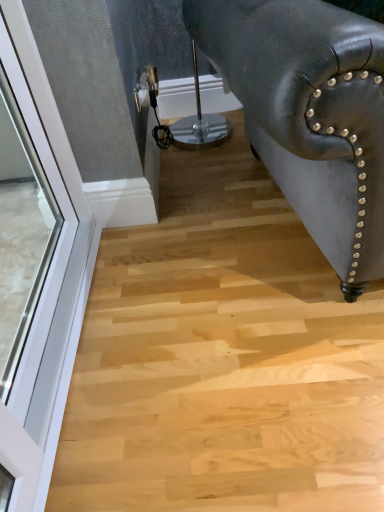
Question: Is matte black leather armchair at right surrounded by white glass window at left?

Choices:
 (A) yes
 (B) no

Answer: (B)

Question: From a real-world perspective, is white glass window at left over matte black leather armchair at right?

Choices:
 (A) no
 (B) yes

Answer: (A)

Question: Can you confirm if white glass window at left is shorter than matte black leather armchair at right?

Choices:
 (A) yes
 (B) no

Answer: (A)

Question: From the image's perspective, is white glass window at left on matte black leather armchair at right?

Choices:
 (A) no
 (B) yes

Answer: (A)

Question: Is white glass window at left positioned far away from matte black leather armchair at right?

Choices:
 (A) yes
 (B) no

Answer: (B)

Question: Is white glass window at left bigger than matte black leather armchair at right?

Choices:
 (A) yes
 (B) no

Answer: (B)

Question: Can you confirm if matte black leather armchair at right is positioned to the left of white glass window at left?

Choices:
 (A) yes
 (B) no

Answer: (B)

Question: From the image's perspective, is matte black leather armchair at right beneath white glass window at left?

Choices:
 (A) no
 (B) yes

Answer: (A)

Question: From a real-world perspective, is matte black leather armchair at right on top of white glass window at left?

Choices:
 (A) no
 (B) yes

Answer: (B)

Question: Is matte black leather armchair at right smaller than white glass window at left?

Choices:
 (A) no
 (B) yes

Answer: (A)

Question: Is matte black leather armchair at right touching white glass window at left?

Choices:
 (A) yes
 (B) no

Answer: (B)

Question: Does matte black leather armchair at right have a greater width compared to white glass window at left?

Choices:
 (A) yes
 (B) no

Answer: (A)

Question: Does point (228, 3) appear closer or farther from the camera than point (44, 450)?

Choices:
 (A) farther
 (B) closer

Answer: (A)